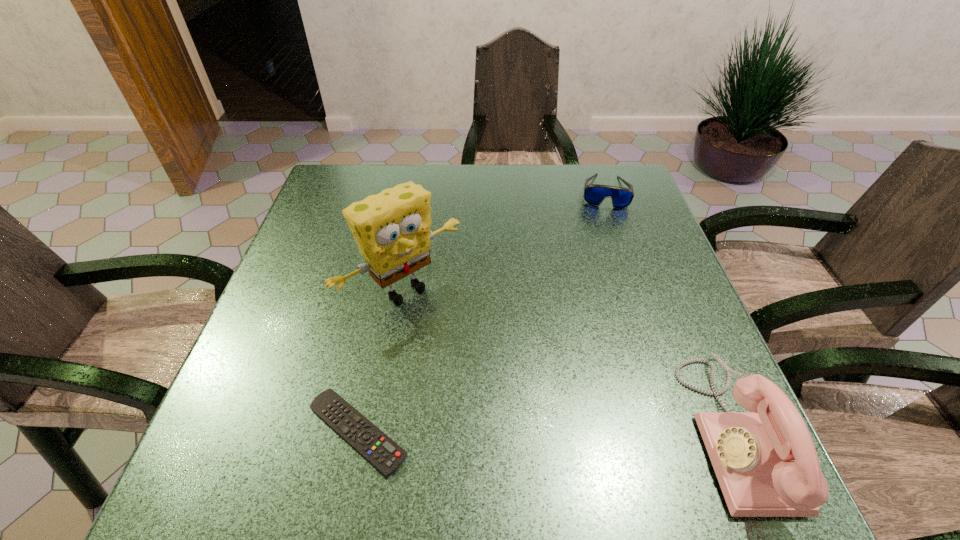
The image size is (960, 540). I want to click on vacant space located 0.250m on the face of the tallest object, so click(x=517, y=400).

Image resolution: width=960 pixels, height=540 pixels. I want to click on free space located on the face of the tallest object, so click(x=461, y=342).

In order to click on blank space located on the face of the tallest object in this screenshot , I will do `click(492, 374)`.

Identify the location of vacant space located on the front-facing side of the third tallest object. The image size is (960, 540). (600, 303).

What are the coordinates of `vacant region located 0.220m on the front-facing side of the third tallest object` in the screenshot? It's located at (602, 264).

The height and width of the screenshot is (540, 960). I want to click on free location located on the front-facing side of the third tallest object, so click(600, 294).

Where is `object positioned at the far edge`? object positioned at the far edge is located at coordinates (594, 194).

Image resolution: width=960 pixels, height=540 pixels. What are the coordinates of `remote control located at the near edge` in the screenshot? It's located at (385, 455).

The image size is (960, 540). Identify the location of telephone positioned at the near edge. (765, 460).

The width and height of the screenshot is (960, 540). What are the coordinates of `remote control present at the left edge` in the screenshot? It's located at (385, 455).